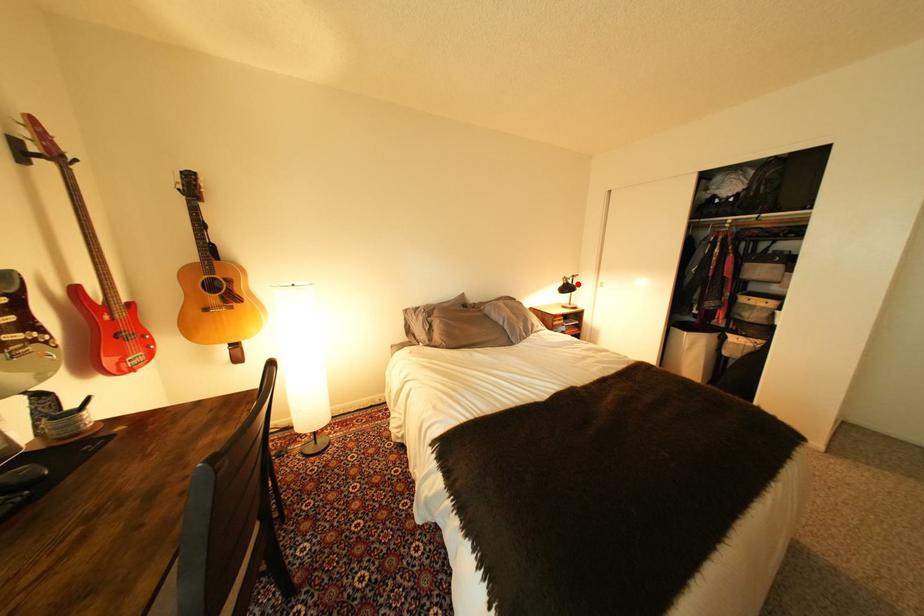
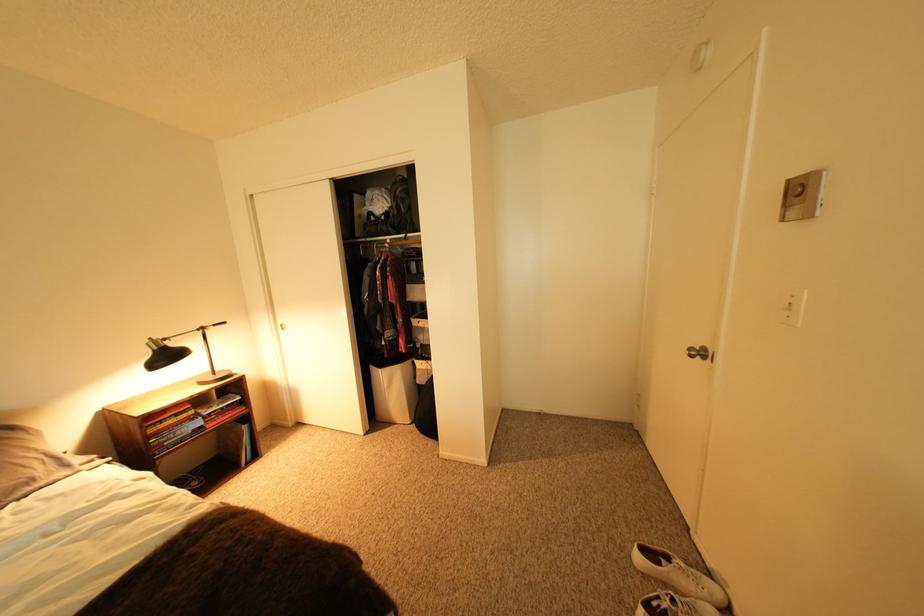
Find the pixel in the second image that matches the highlighted location in the first image.

(168, 350)